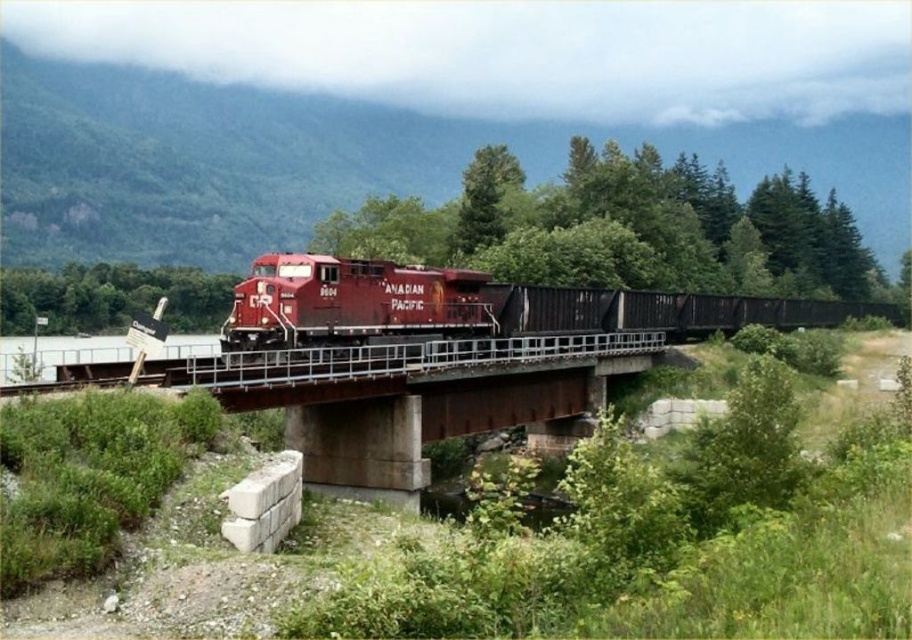
Question: Estimate the real-world distances between objects in this image. Which object is farther from the rusty metal bridge at center?

Choices:
 (A) matte red locomotive at center
 (B) green leafy tree at left
 (C) green leafy tree at center

Answer: (B)

Question: Which object is farther from the camera taking this photo?

Choices:
 (A) rusty metal bridge at center
 (B) green leafy tree at center

Answer: (B)

Question: Does green leafy tree at center have a smaller size compared to rusty metal bridge at center?

Choices:
 (A) no
 (B) yes

Answer: (A)

Question: Which object is closer to the camera taking this photo?

Choices:
 (A) matte red locomotive at center
 (B) green leafy tree at left
 (C) green leafy tree at center

Answer: (A)

Question: Is green leafy tree at center bigger than matte red locomotive at center?

Choices:
 (A) yes
 (B) no

Answer: (A)

Question: From the image, what is the correct spatial relationship of green leafy tree at center in relation to green leafy tree at left?

Choices:
 (A) above
 (B) below

Answer: (A)